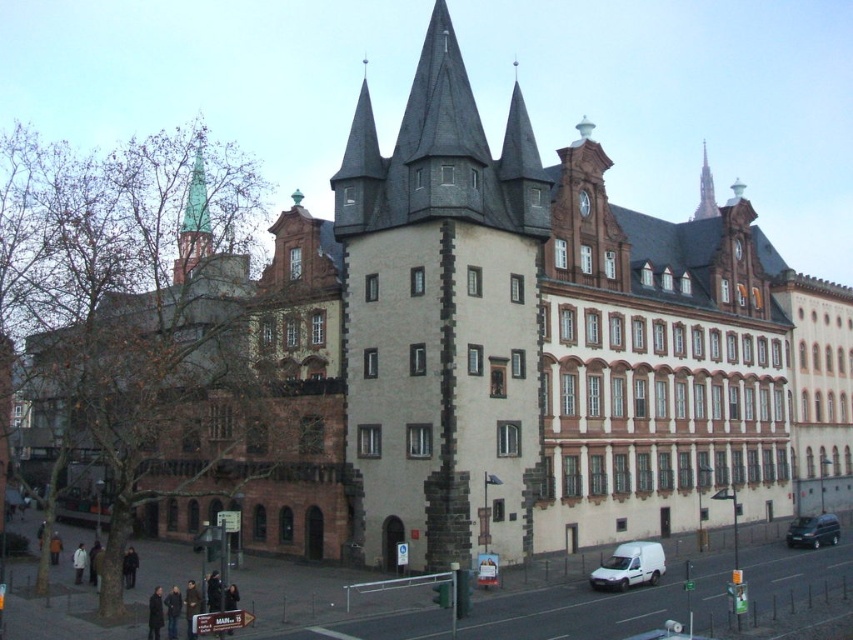
Does point (836, 525) come in front of point (579, 209)?

No.

Can you confirm if dark green matte van at lower right is smaller than metallic clock at upper center?

Actually, dark green matte van at lower right might be larger than metallic clock at upper center.

Is point (822, 541) farther from viewer compared to point (584, 202)?

Yes, point (822, 541) is behind point (584, 202).

In order to click on dark green matte van at lower right in this screenshot , I will do `click(813, 531)`.

Can you confirm if white stone tower at center is positioned above metallic clock at upper center?

Indeed, white stone tower at center is positioned over metallic clock at upper center.

Between point (401, 516) and point (583, 202), which one is positioned behind?

The point (583, 202) is more distant.

Find the location of `white stone tower at center`. white stone tower at center is located at coordinates pos(442,321).

Does glass spire at upper right have a smaller size compared to metallic clock at upper center?

No, glass spire at upper right is not smaller than metallic clock at upper center.

Is glass spire at upper right below metallic clock at upper center?

Actually, glass spire at upper right is above metallic clock at upper center.

Describe the element at coordinates (705, 189) in the screenshot. This screenshot has height=640, width=853. I see `glass spire at upper right` at that location.

The image size is (853, 640). Find the location of `glass spire at upper right`. glass spire at upper right is located at coordinates (705, 189).